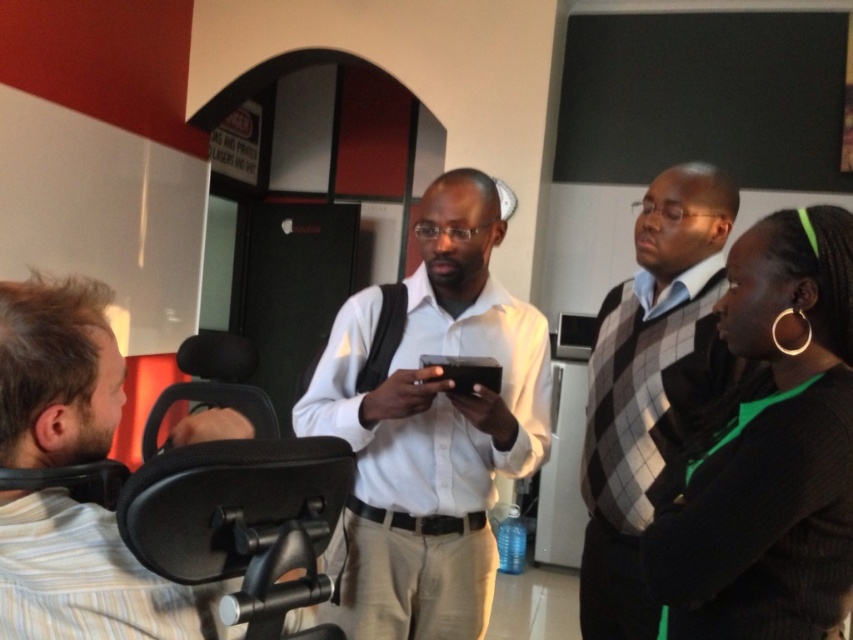
Can you confirm if light brown striped shirt at left is positioned to the right of gray checkered sweater at center?

No, light brown striped shirt at left is not to the right of gray checkered sweater at center.

The width and height of the screenshot is (853, 640). In order to click on light brown striped shirt at left in this screenshot , I will do `click(86, 579)`.

The height and width of the screenshot is (640, 853). I want to click on light brown striped shirt at left, so click(x=86, y=579).

Is white matte shirt at center taller than light brown striped shirt at left?

Indeed, white matte shirt at center has a greater height compared to light brown striped shirt at left.

Between white matte shirt at center and light brown striped shirt at left, which one appears on the right side from the viewer's perspective?

white matte shirt at center is more to the right.

Who is more forward, (397, 570) or (86, 381)?

Positioned in front is point (86, 381).

Identify the location of white matte shirt at center. Image resolution: width=853 pixels, height=640 pixels. (428, 426).

Can you confirm if white matte shirt at center is positioned below black knitwear at right?

Indeed, white matte shirt at center is positioned under black knitwear at right.

Is white matte shirt at center positioned in front of black knitwear at right?

No, it is behind black knitwear at right.

Who is more forward, [450,316] or [763,636]?

Point [763,636]

I want to click on white matte shirt at center, so click(x=428, y=426).